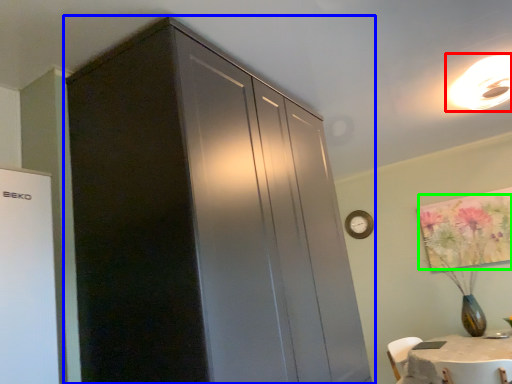
Question: Which is farther away from light fixture (highlighted by a red box)? cupboard (highlighted by a blue box) or flower (highlighted by a green box)?

Choices:
 (A) cupboard
 (B) flower

Answer: (A)